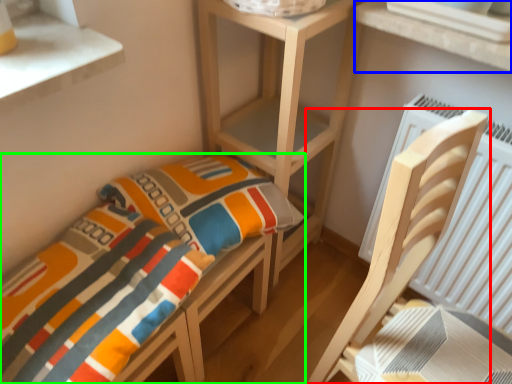
Question: Considering the real-world distances, which object is closest to furniture (highlighted by a red box)? window (highlighted by a blue box) or furniture (highlighted by a green box).

Choices:
 (A) window
 (B) furniture

Answer: (A)